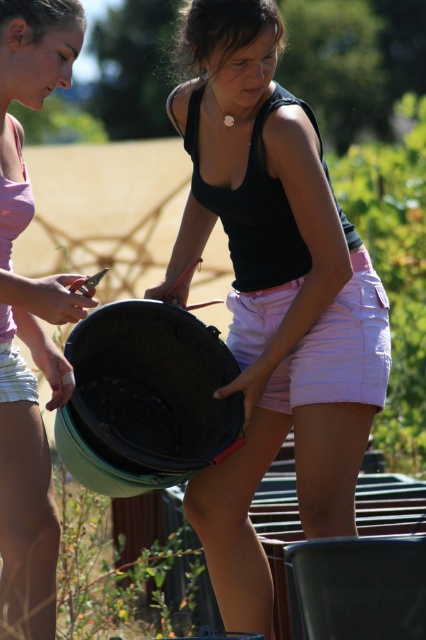
You are standing in the scene and need to move the matte black bucket at lower left to the position of the matte black bucket at center. Which direction should you move it?

You should move the matte black bucket at lower left to the right to reach the position of the matte black bucket at center.

You need to choose a bucket to carry heavy items. Which bucket between the matte black bucket at center and the matte black bucket at lower left would you choose and why?

The matte black bucket at center is larger in size than the matte black bucket at lower left, so you should choose the matte black bucket at center because it can hold more items.